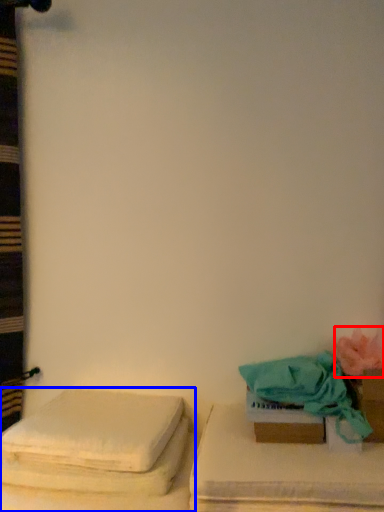
Question: Which object is further to the camera taking this photo, flower (highlighted by a red box) or furniture (highlighted by a blue box)?

Choices:
 (A) flower
 (B) furniture

Answer: (A)